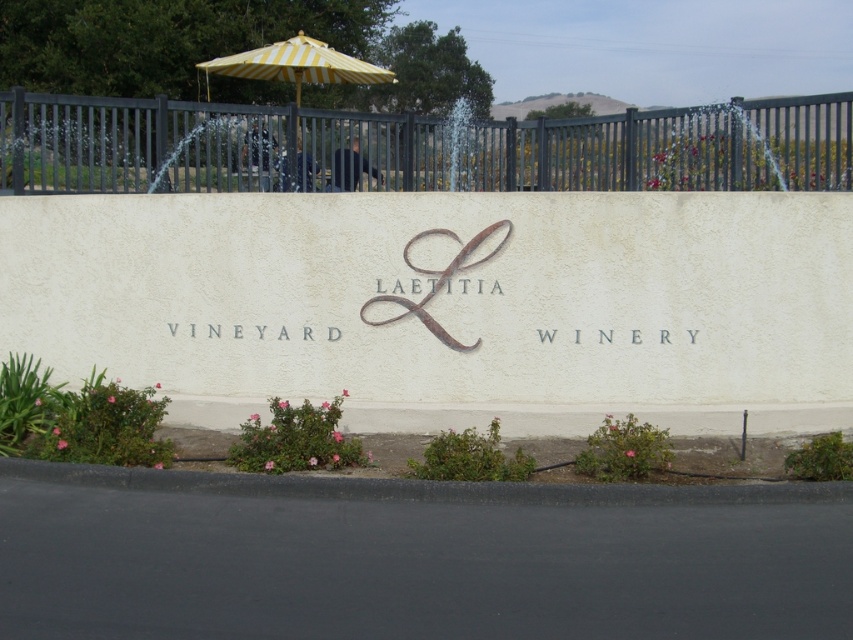
Question: In this image, where is black metal fence at upper center located relative to yellow striped umbrella at upper center?

Choices:
 (A) left
 (B) right

Answer: (B)

Question: Can you confirm if black metal fence at upper center is positioned to the right of yellow striped umbrella at upper center?

Choices:
 (A) yes
 (B) no

Answer: (A)

Question: Which point is farther from the camera taking this photo?

Choices:
 (A) (769, 184)
 (B) (296, 93)

Answer: (B)

Question: Does black metal fence at upper center have a smaller size compared to yellow striped umbrella at upper center?

Choices:
 (A) yes
 (B) no

Answer: (B)